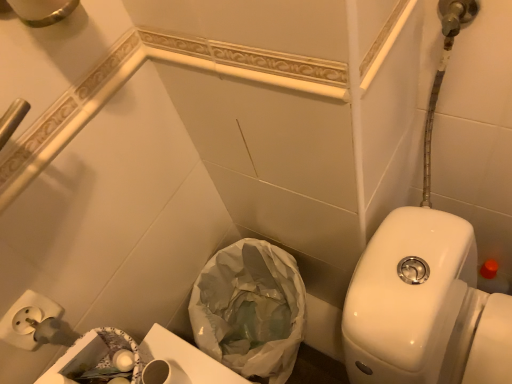
Question: Can you see white glossy toilet at right touching white plastic bag at lower center?

Choices:
 (A) no
 (B) yes

Answer: (A)

Question: Can you confirm if white glossy toilet at right is wider than white plastic bag at lower center?

Choices:
 (A) yes
 (B) no

Answer: (A)

Question: Is white glossy toilet at right at the right side of white plastic bag at lower center?

Choices:
 (A) no
 (B) yes

Answer: (B)

Question: Considering the relative sizes of white glossy toilet at right and white plastic bag at lower center in the image provided, is white glossy toilet at right shorter than white plastic bag at lower center?

Choices:
 (A) yes
 (B) no

Answer: (A)

Question: From a real-world perspective, is white glossy toilet at right on top of white plastic bag at lower center?

Choices:
 (A) no
 (B) yes

Answer: (B)

Question: Considering the relative sizes of white glossy toilet at right and white plastic bag at lower center in the image provided, is white glossy toilet at right smaller than white plastic bag at lower center?

Choices:
 (A) yes
 (B) no

Answer: (B)

Question: Does white plastic bag at lower center have a greater width compared to white glossy toilet at right?

Choices:
 (A) yes
 (B) no

Answer: (B)

Question: Would you say white glossy toilet at right is part of white plastic bag at lower center's contents?

Choices:
 (A) yes
 (B) no

Answer: (B)

Question: Is white plastic bag at lower center taller than white glossy toilet at right?

Choices:
 (A) yes
 (B) no

Answer: (A)

Question: Considering the relative sizes of white plastic bag at lower center and white glossy toilet at right in the image provided, is white plastic bag at lower center thinner than white glossy toilet at right?

Choices:
 (A) no
 (B) yes

Answer: (B)

Question: Is white plastic bag at lower center not within white glossy toilet at right?

Choices:
 (A) no
 (B) yes

Answer: (B)

Question: Is white plastic bag at lower center oriented away from white glossy toilet at right?

Choices:
 (A) yes
 (B) no

Answer: (B)

Question: Considering the positions of white glossy toilet at right and white plastic bag at lower center in the image, is white glossy toilet at right wider or thinner than white plastic bag at lower center?

Choices:
 (A) wide
 (B) thin

Answer: (A)